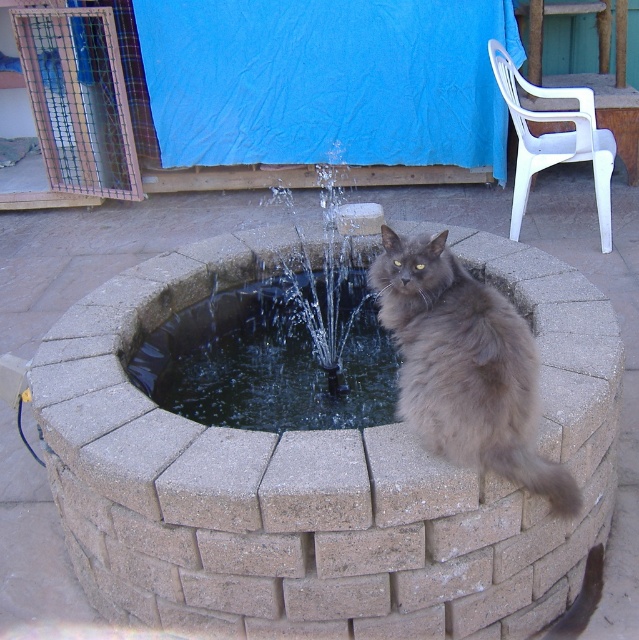
Question: Is brown brick fountain at center smaller than gray fluffy cat at upper center?

Choices:
 (A) yes
 (B) no

Answer: (B)

Question: Does brown brick fountain at center have a lesser width compared to clear water at fountain center?

Choices:
 (A) yes
 (B) no

Answer: (B)

Question: Which object appears closest to the camera in this image?

Choices:
 (A) clear water at fountain center
 (B) brown brick fountain at center

Answer: (A)

Question: Does brown brick fountain at center appear under clear water at fountain center?

Choices:
 (A) yes
 (B) no

Answer: (B)

Question: Which point appears closest to the camera in this image?

Choices:
 (A) [335, 266]
 (B) [392, 332]

Answer: (B)

Question: Estimate the real-world distances between objects in this image. Which object is closer to the gray fluffy cat at upper center?

Choices:
 (A) clear water at fountain center
 (B) brown brick fountain at center

Answer: (A)